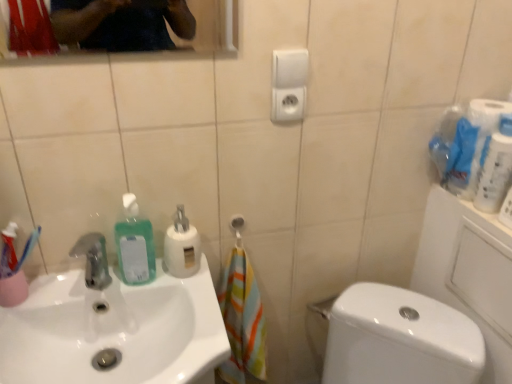
At what (x,y) coordinates should I click in order to perform the action: click on vacant area that is in front of white matte soap dispenser at center, which is the 1th cleaning product in right-to-left order. Please return your answer as a coordinate pair (x, y). The image size is (512, 384). Looking at the image, I should click on (192, 302).